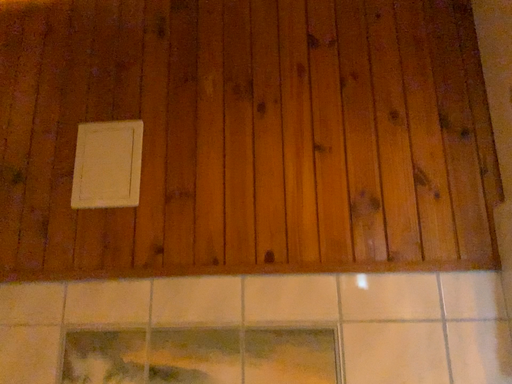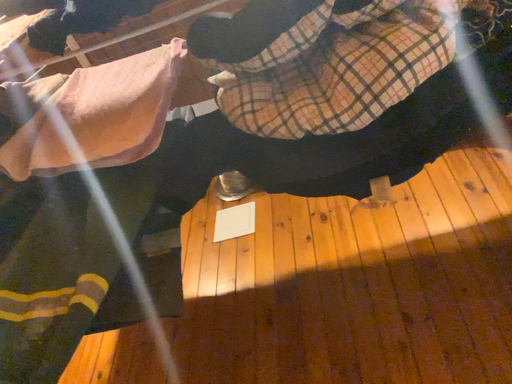
Question: Which way did the camera rotate in the video?

Choices:
 (A) rotated right
 (B) rotated left

Answer: (B)